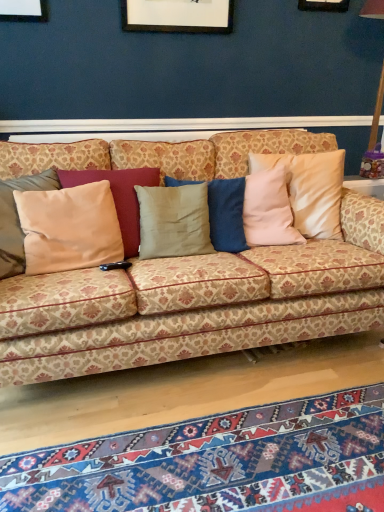
Question: Can you confirm if textured wool mat at lower center is wider than satin beige pillow at left?

Choices:
 (A) no
 (B) yes

Answer: (B)

Question: Is textured wool mat at lower center aimed at satin beige pillow at left?

Choices:
 (A) yes
 (B) no

Answer: (B)

Question: Is textured wool mat at lower center far away from satin beige pillow at left?

Choices:
 (A) no
 (B) yes

Answer: (A)

Question: From the image's perspective, would you say textured wool mat at lower center is positioned over satin beige pillow at left?

Choices:
 (A) no
 (B) yes

Answer: (A)

Question: Is textured wool mat at lower center located outside satin beige pillow at left?

Choices:
 (A) no
 (B) yes

Answer: (B)

Question: Choose the correct answer: Is patterned fabric couch at center inside satin beige pillow at left or outside it?

Choices:
 (A) inside
 (B) outside

Answer: (B)

Question: Considering their positions, is patterned fabric couch at center located in front of or behind satin beige pillow at left?

Choices:
 (A) behind
 (B) front

Answer: (B)

Question: From the image's perspective, is patterned fabric couch at center positioned above or below satin beige pillow at left?

Choices:
 (A) above
 (B) below

Answer: (B)

Question: In terms of height, does patterned fabric couch at center look taller or shorter compared to satin beige pillow at left?

Choices:
 (A) short
 (B) tall

Answer: (B)

Question: Would you say satin beige pillow at left is inside or outside patterned fabric couch at center?

Choices:
 (A) outside
 (B) inside

Answer: (B)

Question: In terms of width, does satin beige pillow at left look wider or thinner when compared to patterned fabric couch at center?

Choices:
 (A) wide
 (B) thin

Answer: (B)

Question: Is point (74, 224) positioned closer to the camera than point (192, 333)?

Choices:
 (A) farther
 (B) closer

Answer: (A)

Question: Is satin beige pillow at left taller or shorter than patterned fabric couch at center?

Choices:
 (A) short
 (B) tall

Answer: (A)

Question: In the image, is textured wool mat at lower center positioned in front of or behind satin beige pillow at left?

Choices:
 (A) behind
 (B) front

Answer: (B)

Question: Is textured wool mat at lower center bigger or smaller than satin beige pillow at left?

Choices:
 (A) big
 (B) small

Answer: (A)